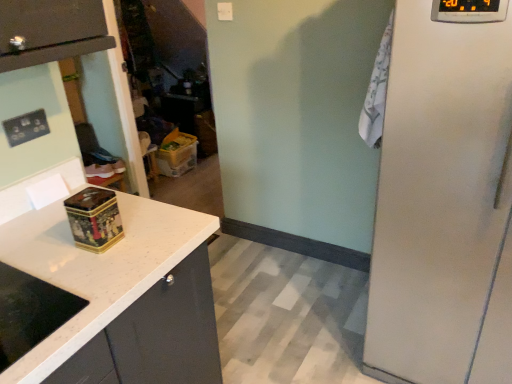
Question: Which is correct: transparent plastic door at center is inside gold metallic tin at center, the second appliance from the top, or outside of it?

Choices:
 (A) inside
 (B) outside

Answer: (B)

Question: From the image's perspective, is transparent plastic door at center located above or below gold metallic tin at center, the 2th appliance viewed from the right?

Choices:
 (A) below
 (B) above

Answer: (B)

Question: Which object is positioned closest to the matte black outlet at upper left?

Choices:
 (A) transparent plastic door at center
 (B) white granite countertop at left
 (C) gold metallic tin at center, the 2th appliance viewed from the right
 (D) satin white refrigerator at right, marked as the second appliance in a bottom-to-top arrangement

Answer: (C)

Question: Estimate the real-world distances between objects in this image. Which object is closer to the gold metallic tin at center, the second appliance when ordered from front to back?

Choices:
 (A) satin white refrigerator at right, which appears as the second appliance when viewed from the back
 (B) transparent plastic door at center
 (C) matte black outlet at upper left
 (D) white granite countertop at left

Answer: (D)